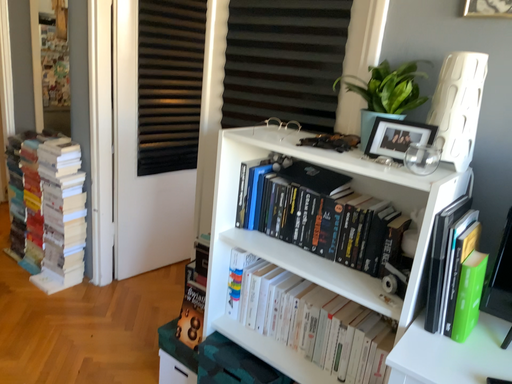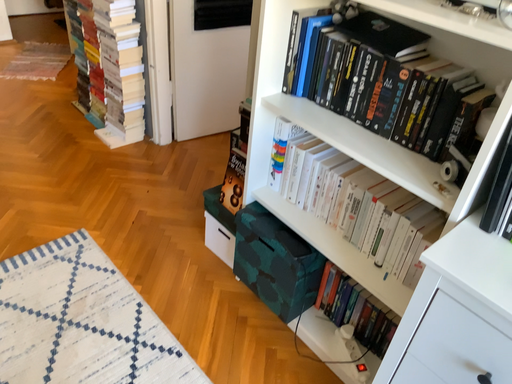
Question: How did the camera likely rotate when shooting the video?

Choices:
 (A) rotated right
 (B) rotated left

Answer: (B)